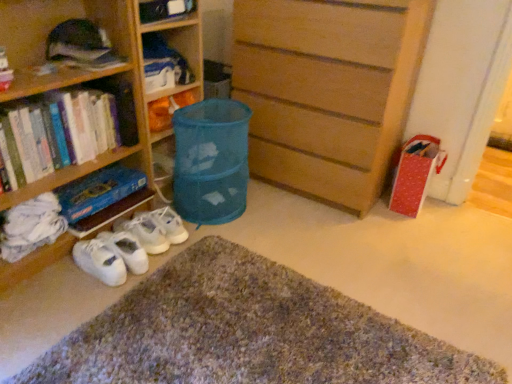
Where is `vacant space in between wooden chest of drawers at center and blue fabric laundry basket at center`? vacant space in between wooden chest of drawers at center and blue fabric laundry basket at center is located at coordinates (279, 220).